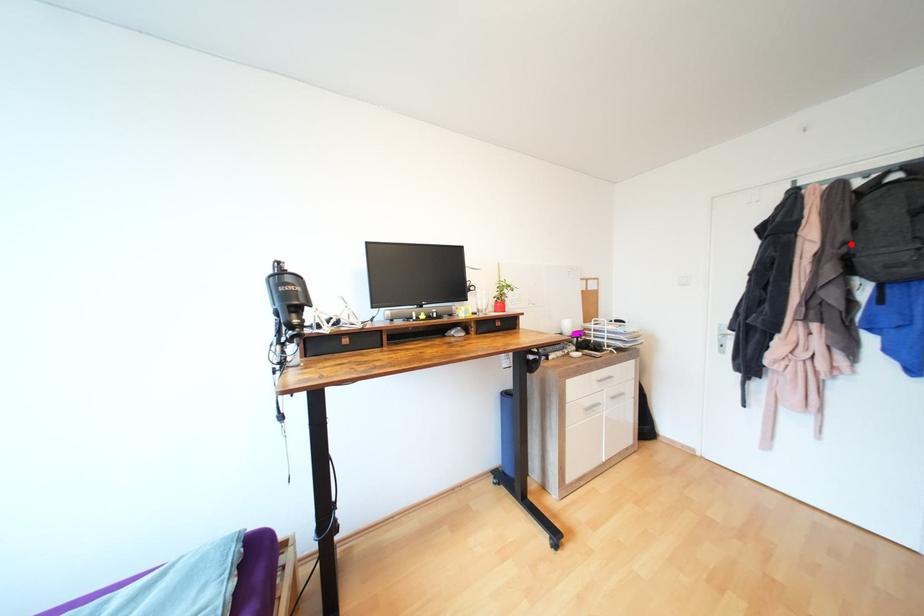
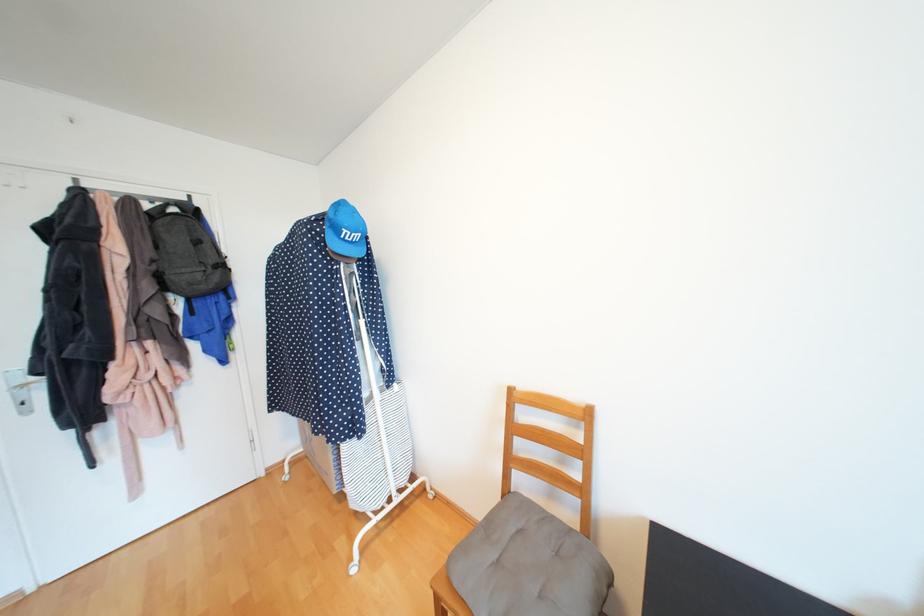
The point at the highlighted location is marked in the first image. Where is the corresponding point in the second image?

(160, 262)